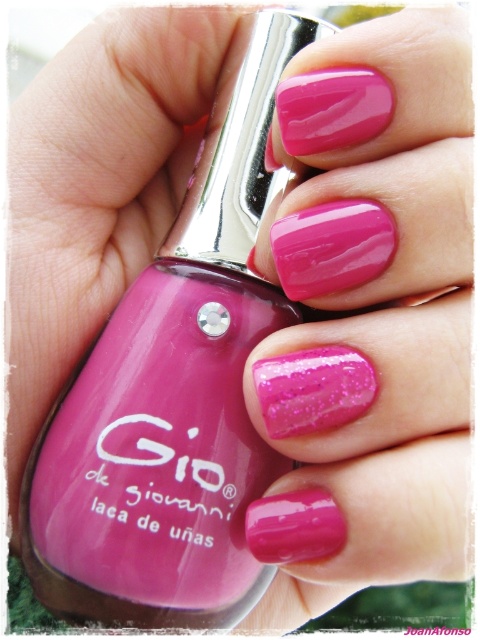
Is point (458, 188) positioned after point (82, 600)?

No, (458, 188) is in front of (82, 600).

The width and height of the screenshot is (480, 640). Describe the element at coordinates (368, 316) in the screenshot. I see `glossy pink nails at center` at that location.

Which is in front, point (263, 275) or point (265, 305)?

Point (263, 275) is more forward.

Find the location of a particular element. The width and height of the screenshot is (480, 640). glossy pink nails at center is located at coordinates (368, 316).